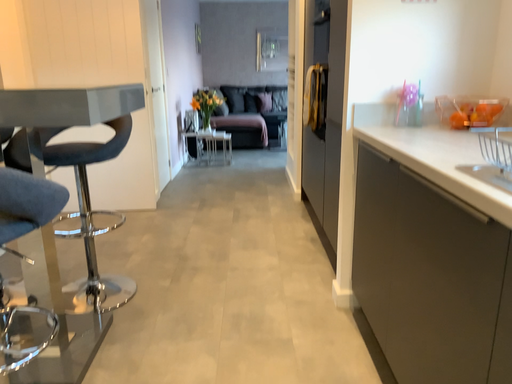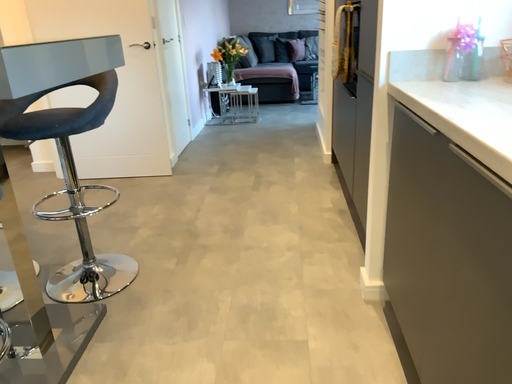
Question: Which way did the camera rotate in the video?

Choices:
 (A) rotated downward
 (B) rotated upward

Answer: (A)